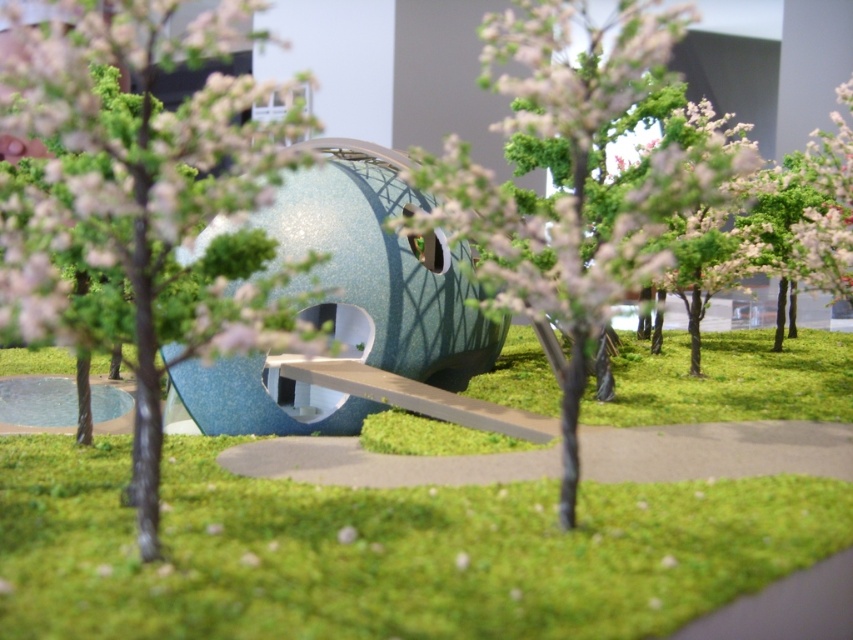
Question: Does green leafy tree at center appear under green matte tree at center?

Choices:
 (A) yes
 (B) no

Answer: (A)

Question: Which point appears farthest from the camera in this image?

Choices:
 (A) (820, 525)
 (B) (686, 148)

Answer: (B)

Question: Can you confirm if green grass at center is positioned to the right of green leafy tree at center?

Choices:
 (A) no
 (B) yes

Answer: (B)

Question: Which point appears farthest from the camera in this image?

Choices:
 (A) (521, 100)
 (B) (50, 253)

Answer: (A)

Question: Estimate the real-world distances between objects in this image. Which object is farther from the green grass at center?

Choices:
 (A) green matte tree at center
 (B) green leafy tree at center

Answer: (A)

Question: Considering the relative positions of green grass at center and green matte tree at center in the image provided, where is green grass at center located with respect to green matte tree at center?

Choices:
 (A) below
 (B) above

Answer: (A)